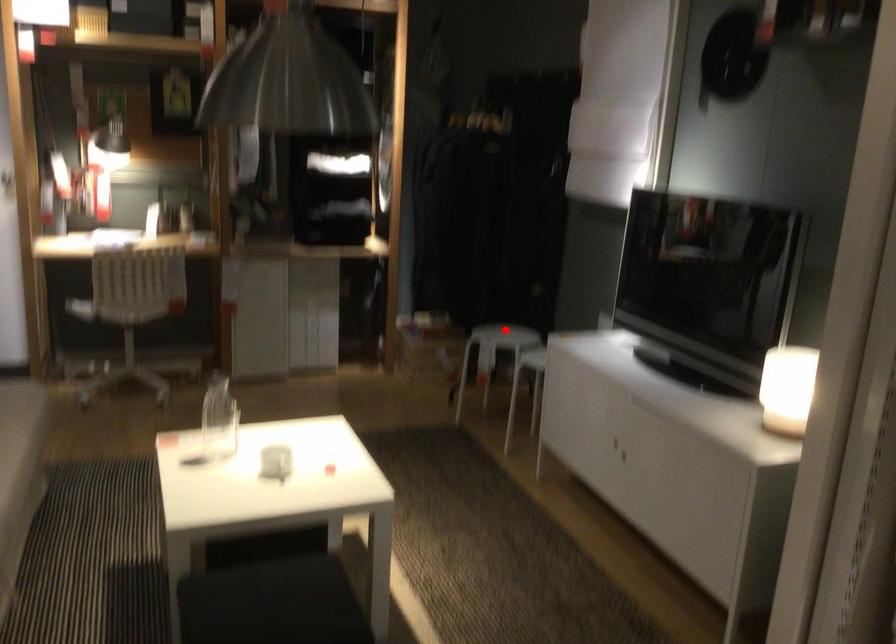
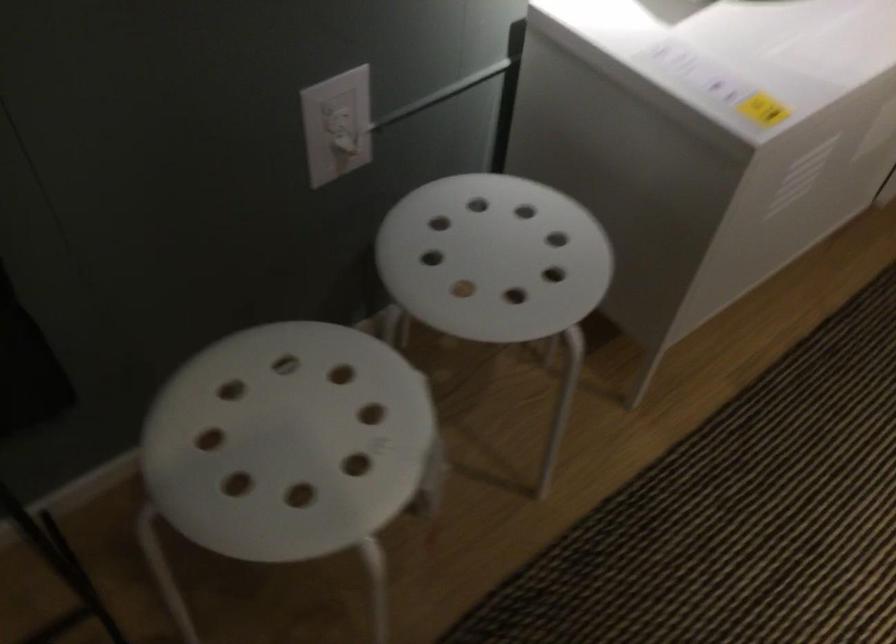
In the second image, find the point that corresponds to the highlighted location in the first image.

(288, 442)